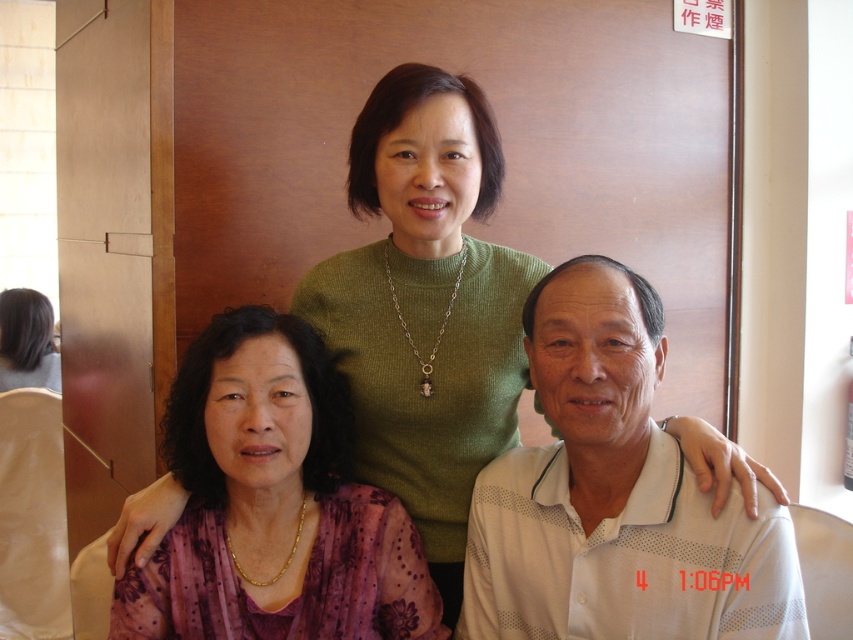
Question: Among these objects, which one is farthest from the camera?

Choices:
 (A) purple sheer blouse at center
 (B) matte purple blouse at lower left

Answer: (B)

Question: Does matte green sweater at center appear on the left side of matte purple blouse at lower left?

Choices:
 (A) yes
 (B) no

Answer: (B)

Question: Which object is the closest to the white textured polo shirt at center?

Choices:
 (A) matte purple blouse at lower left
 (B) matte green sweater at center

Answer: (B)

Question: Does matte green sweater at center come in front of purple sheer blouse at center?

Choices:
 (A) no
 (B) yes

Answer: (A)

Question: Which object is the farthest from the purple sheer blouse at center?

Choices:
 (A) white textured polo shirt at center
 (B) matte green sweater at center

Answer: (A)

Question: Observing the image, what is the correct spatial positioning of white textured polo shirt at center in reference to purple sheer blouse at center?

Choices:
 (A) below
 (B) above

Answer: (B)